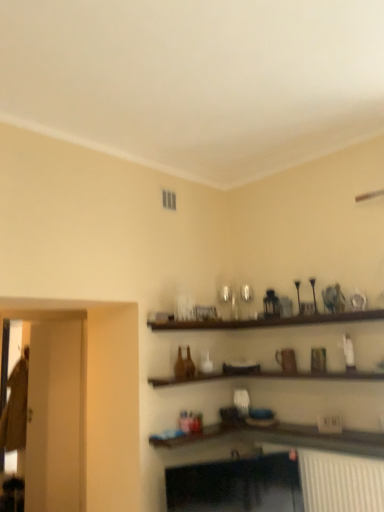
Question: From a real-world perspective, is transparent glass door at left, which is the 1th glass door in front-to-back order, under transparent glass door at left, the 2th glass door when ordered from front to back?

Choices:
 (A) no
 (B) yes

Answer: (A)

Question: Is transparent glass door at left, which is the 1th glass door in front-to-back order, taller than transparent glass door at left, positioned as the second glass door in right-to-left order?

Choices:
 (A) no
 (B) yes

Answer: (B)

Question: From the image's perspective, is transparent glass door at left, the 1th glass door in the right-to-left sequence, located beneath transparent glass door at left, the 2th glass door when ordered from front to back?

Choices:
 (A) no
 (B) yes

Answer: (A)

Question: From a real-world perspective, is transparent glass door at left, the 1th glass door in the right-to-left sequence, physically above transparent glass door at left, the 2th glass door when ordered from front to back?

Choices:
 (A) yes
 (B) no

Answer: (A)

Question: Could you tell me if transparent glass door at left, the 1th glass door in the right-to-left sequence, is facing transparent glass door at left, the 1th glass door from the back?

Choices:
 (A) yes
 (B) no

Answer: (B)

Question: Is transparent glass door at left, which is the 1th glass door in front-to-back order, facing away from transparent glass door at left, the 2th glass door when ordered from front to back?

Choices:
 (A) no
 (B) yes

Answer: (B)

Question: Is transparent glass door at left, the 2th glass door when ordered from front to back, turned away from transparent glass door at left, marked as the second glass door in a back-to-front arrangement?

Choices:
 (A) no
 (B) yes

Answer: (A)

Question: Can you confirm if transparent glass door at left, the 1th glass door from the back, is wider than transparent glass door at left, which is the 1th glass door in front-to-back order?

Choices:
 (A) no
 (B) yes

Answer: (B)

Question: From a real-world perspective, is transparent glass door at left, positioned as the second glass door in right-to-left order, on transparent glass door at left, which is the 1th glass door in front-to-back order?

Choices:
 (A) yes
 (B) no

Answer: (B)

Question: Considering the relative sizes of transparent glass door at left, the 2th glass door when ordered from front to back, and transparent glass door at left, the second glass door in the left-to-right sequence, in the image provided, is transparent glass door at left, the 2th glass door when ordered from front to back, bigger than transparent glass door at left, the second glass door in the left-to-right sequence,?

Choices:
 (A) no
 (B) yes

Answer: (B)

Question: Does transparent glass door at left, the 2th glass door when ordered from front to back, lie in front of transparent glass door at left, marked as the second glass door in a back-to-front arrangement?

Choices:
 (A) no
 (B) yes

Answer: (A)

Question: Is transparent glass door at left, the 1th glass door from the back, to the left of transparent glass door at left, which is the 1th glass door in front-to-back order, from the viewer's perspective?

Choices:
 (A) no
 (B) yes

Answer: (B)

Question: Considering their positions, is transparent glass door at left, the 2th glass door when ordered from front to back, located in front of or behind transparent glass door at left, marked as the second glass door in a back-to-front arrangement?

Choices:
 (A) behind
 (B) front

Answer: (A)